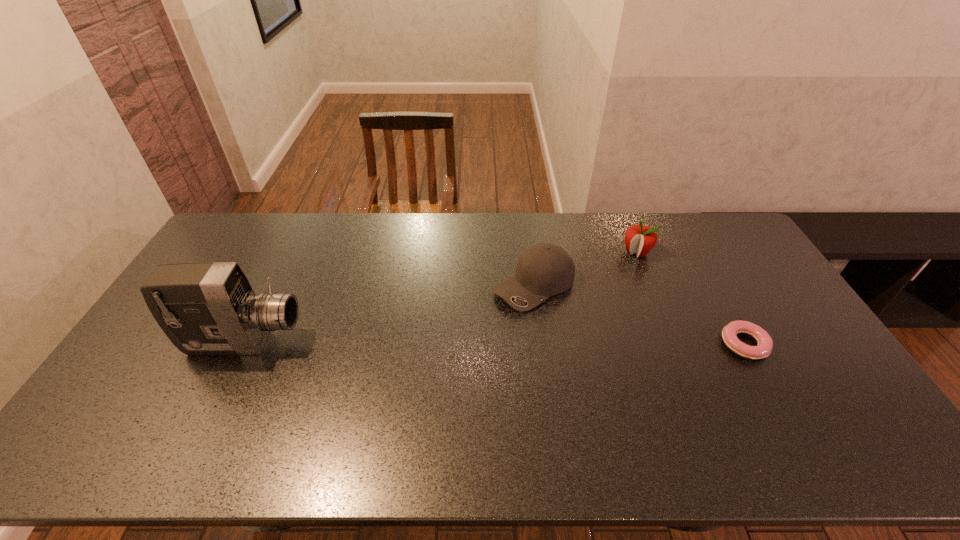
Locate an element on the screen. This screenshot has width=960, height=540. the leftmost object is located at coordinates (205, 308).

Where is `camcorder`? This screenshot has height=540, width=960. camcorder is located at coordinates (205, 308).

Image resolution: width=960 pixels, height=540 pixels. Identify the location of the rightmost object. (764, 347).

At what (x,y) coordinates should I click in order to perform the action: click on the shortest object. Please return your answer as a coordinate pair (x, y). Looking at the image, I should click on (764, 347).

The height and width of the screenshot is (540, 960). In order to click on apple in this screenshot , I will do `click(640, 239)`.

The width and height of the screenshot is (960, 540). In order to click on baseball cap in this screenshot , I will do `click(543, 270)`.

The height and width of the screenshot is (540, 960). What are the coordinates of `free space located at the front of the camcorder, highlighting the lens` in the screenshot? It's located at (440, 342).

In order to click on free region located on the front of the doughnut in this screenshot , I will do `click(780, 408)`.

Locate an element on the screen. vacant space located on the side where a bite is taken out of the third object from left to right is located at coordinates (610, 284).

What are the coordinates of `free space located on the side where a bite is taken out of the third object from left to right` in the screenshot? It's located at (613, 279).